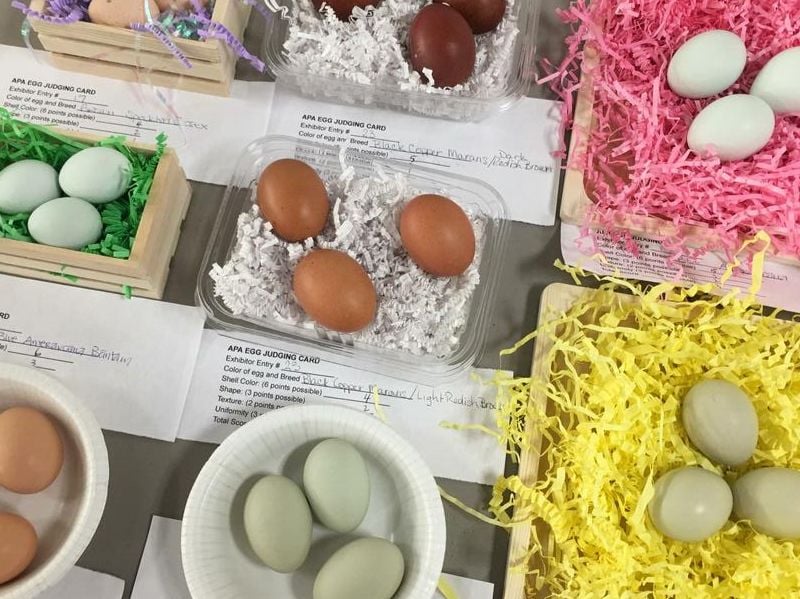
This screenshot has width=800, height=599. Identify the location of three green eggs in bowl. (368, 568), (369, 487), (273, 532).